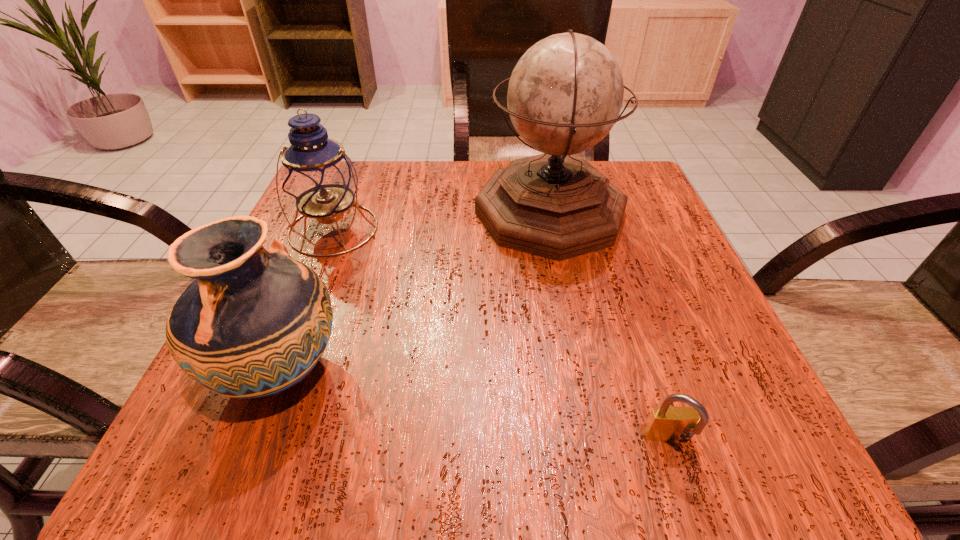
Identify the location of the tallest object. Image resolution: width=960 pixels, height=540 pixels. (565, 94).

You are a GUI agent. You are given a task and a screenshot of the screen. Output one action in this format:
    pyautogui.click(x=<x>, y=<y>)
    Task: Click on the lantern
    
    Given the screenshot: What is the action you would take?
    pyautogui.click(x=318, y=177)

Locate an element on the screen. This screenshot has height=540, width=960. pottery is located at coordinates [x=253, y=323].

Where is `the shortest object`? This screenshot has height=540, width=960. the shortest object is located at coordinates (667, 424).

Where is `vacant area situated 0.380m on the surface of the tallest object`? The width and height of the screenshot is (960, 540). vacant area situated 0.380m on the surface of the tallest object is located at coordinates (296, 213).

Locate an element on the screen. vacant region located 0.200m on the surface of the tallest object is located at coordinates (380, 213).

Locate an element on the screen. free spot located on the surface of the tallest object is located at coordinates (390, 213).

Identify the location of vacant point located 0.160m on the front-facing side of the lantern. (297, 322).

At what (x,y) coordinates should I click in order to perform the action: click on free space located 0.050m on the right of the pottery. Please return your answer as a coordinate pair (x, y). This screenshot has width=960, height=540. Looking at the image, I should click on (381, 372).

What are the coordinates of `globe that is at the far edge` in the screenshot? It's located at (565, 94).